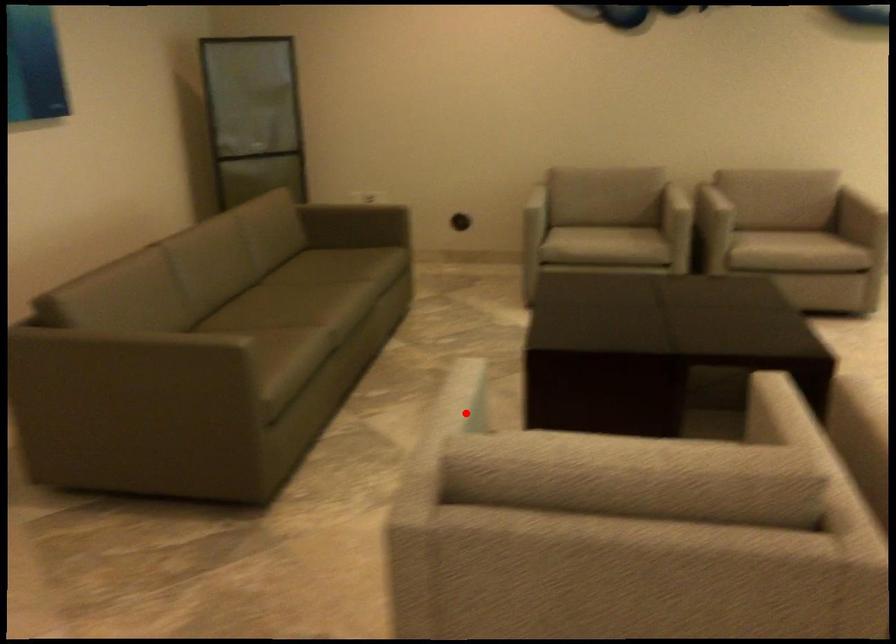
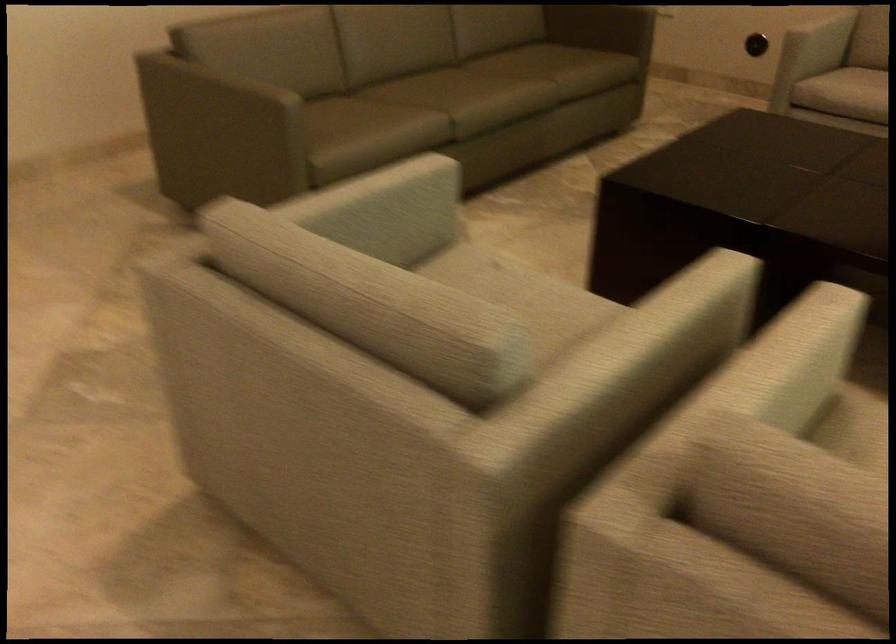
Where in the second image is the point corresponding to the highlighted location from the first image?

(380, 210)